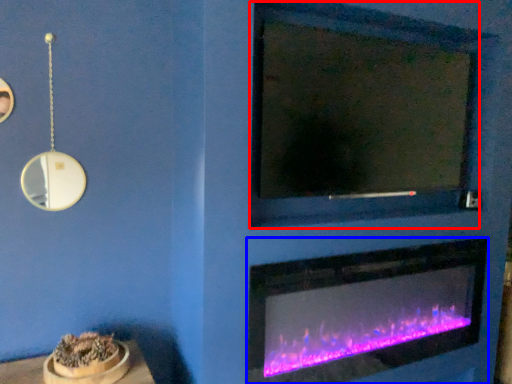
Question: Which point is further to the camera, mirror (highlighted by a red box) or fireplace (highlighted by a blue box)?

Choices:
 (A) mirror
 (B) fireplace

Answer: (B)